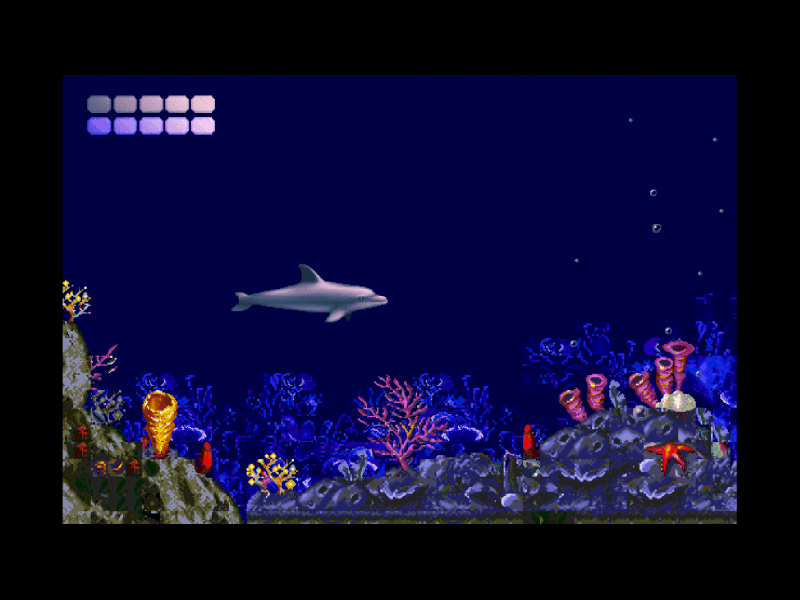
You are a GUI agent. You are given a task and a screenshot of the screen. Output one action in this format:
    pyautogui.click(x=<x>, y=<y>)
    Task: Click on the black frame around the sea photo
    
    Given the screenshot: What is the action you would take?
    pyautogui.click(x=44, y=60), pyautogui.click(x=749, y=567)